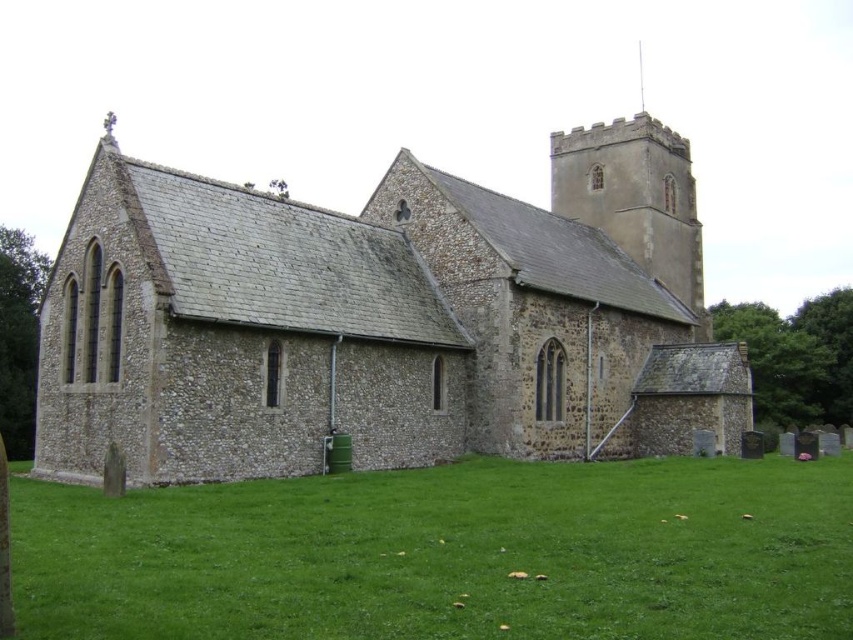
Question: Is stone church at center positioned behind green grass at lower center?

Choices:
 (A) no
 (B) yes

Answer: (B)

Question: Is stone church at center smaller than green grass at lower center?

Choices:
 (A) yes
 (B) no

Answer: (B)

Question: Can you confirm if stone church at center is positioned to the right of green grass at lower center?

Choices:
 (A) no
 (B) yes

Answer: (B)